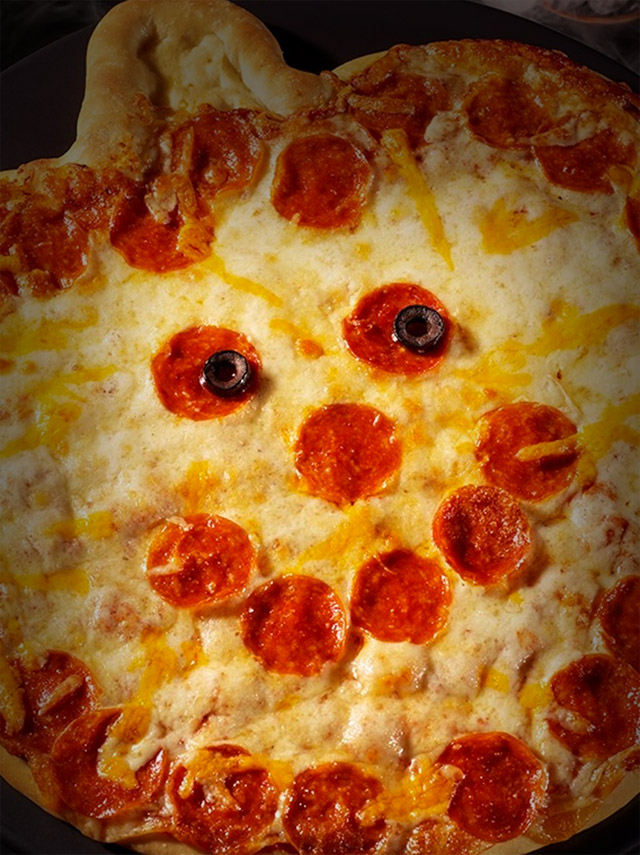
This screenshot has width=640, height=855. Identify the location of table. (621, 40).